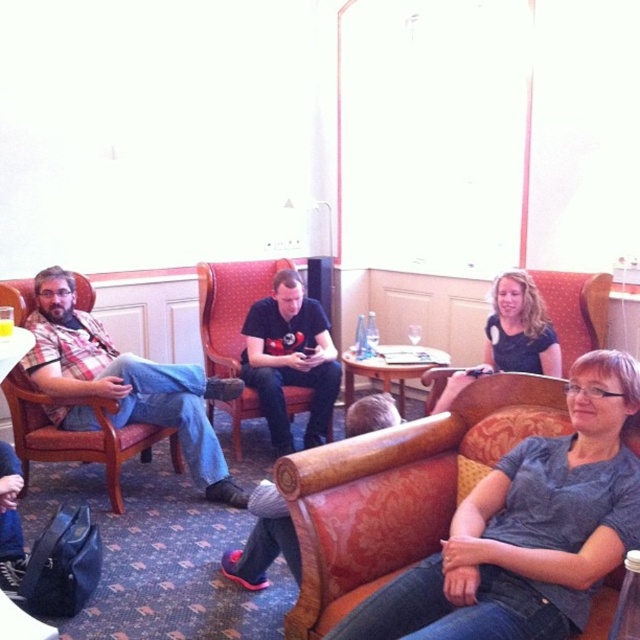
Question: Which point is farther to the camera?

Choices:
 (A) (426, 372)
 (B) (326, 413)
 (C) (26, 355)

Answer: (B)

Question: Is gray cotton shirt at center to the left of velvet-like orange armchair at center from the viewer's perspective?

Choices:
 (A) no
 (B) yes

Answer: (B)

Question: Where is gray cotton shirt at center located in relation to plaid fabric shirt at left in the image?

Choices:
 (A) above
 (B) below

Answer: (B)

Question: Does gray cotton shirt at center appear on the right side of plaid fabric shirt at left?

Choices:
 (A) no
 (B) yes

Answer: (B)

Question: Which object appears farthest from the camera in this image?

Choices:
 (A) plaid fabric shirt at left
 (B) gray cotton shirt at center
 (C) velvet-like orange armchair at center
 (D) black matte shirt at center

Answer: (D)

Question: Which is farther from the black matte shirt at center?

Choices:
 (A) gray cotton shirt at center
 (B) plaid fabric shirt at left
 (C) velvet-like orange armchair at center

Answer: (A)